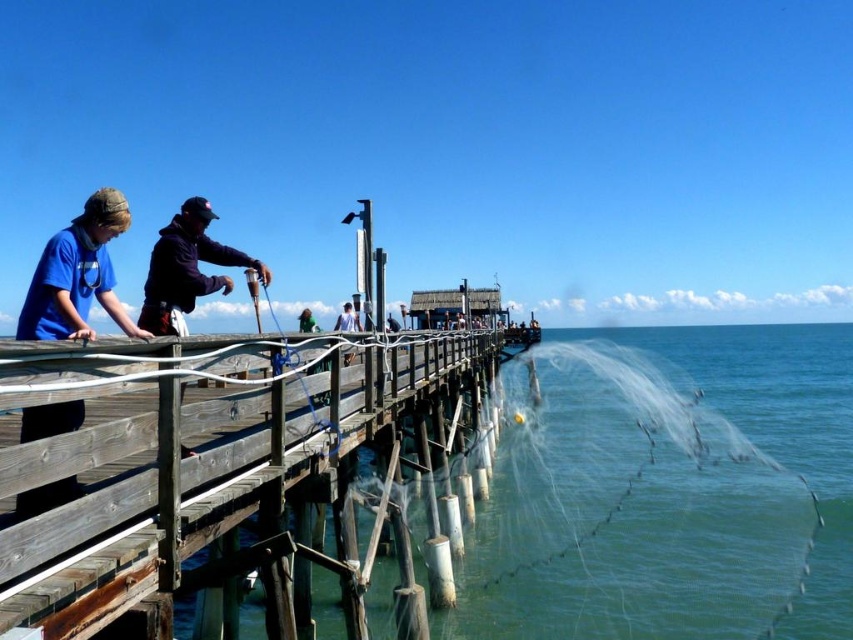
Is weathered wood rail at center below blue matte shirt at left?

Indeed, weathered wood rail at center is positioned under blue matte shirt at left.

Does weathered wood rail at center come in front of blue matte shirt at left?

Yes, it is.

The image size is (853, 640). Find the location of `weathered wood rail at center`. weathered wood rail at center is located at coordinates (206, 465).

You are a GUI agent. You are given a task and a screenshot of the screen. Output one action in this format:
    pyautogui.click(x=<x>, y=<y>)
    Task: Click on the weathered wood rail at center
    This screenshot has width=853, height=640.
    Given the screenshot: What is the action you would take?
    pyautogui.click(x=206, y=465)

Who is lower down, blue matte shirt at left or dark blue hoodie at center?

blue matte shirt at left

What are the coordinates of `blue matte shirt at left` in the screenshot? It's located at (77, 275).

Describe the element at coordinates (77, 275) in the screenshot. I see `blue matte shirt at left` at that location.

Identify the location of blue matte shirt at left. (77, 275).

Is point (132, 612) positioned after point (268, 272)?

No, (132, 612) is closer to viewer.

Locate an element on the screen. weathered wood rail at center is located at coordinates (206, 465).